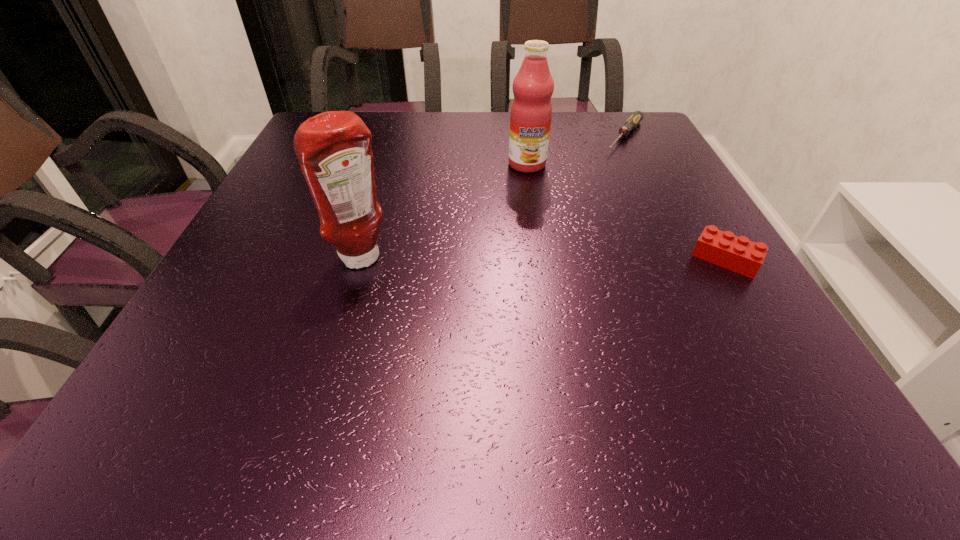
Where is `vacant area situated 0.350m on the label of the fruit juice`? The width and height of the screenshot is (960, 540). vacant area situated 0.350m on the label of the fruit juice is located at coordinates (531, 274).

Identify the location of vacant space situated 0.220m insert the farthest object into a screw head. This screenshot has height=540, width=960. (586, 190).

Where is `blank space located 0.190m insert the farthest object into a screw head`? blank space located 0.190m insert the farthest object into a screw head is located at coordinates (x=590, y=184).

Where is `vacant area situated 0.360m insert the farthest object into a screw head`? The image size is (960, 540). vacant area situated 0.360m insert the farthest object into a screw head is located at coordinates (560, 221).

Image resolution: width=960 pixels, height=540 pixels. What are the coordinates of `object present at the far edge` in the screenshot? It's located at (637, 116).

Locate an element on the screen. Lego present at the right edge is located at coordinates (x=739, y=254).

Identify the location of screwdriver that is positioned at the right edge. The image size is (960, 540). (637, 116).

Where is `object that is at the far right corner`? object that is at the far right corner is located at coordinates (637, 116).

The image size is (960, 540). I want to click on vacant space at the far edge of the desktop, so click(419, 150).

Find the location of `vacant space at the left edge`. vacant space at the left edge is located at coordinates (259, 219).